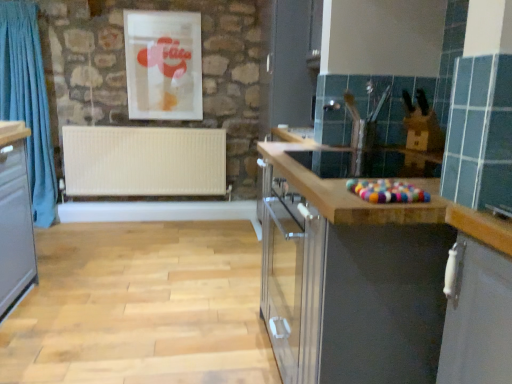
This screenshot has height=384, width=512. I want to click on blank space above white matte radiator at center (from a real-world perspective), so click(140, 127).